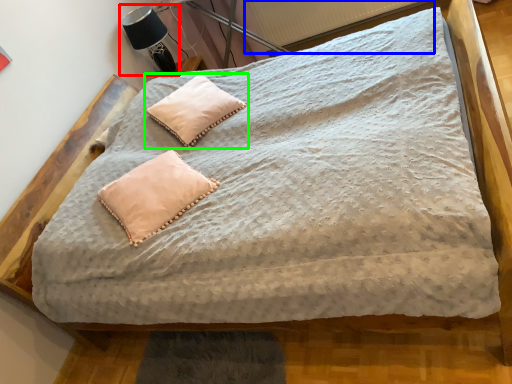
Question: Based on their relative distances, which object is farther from table lamp (highlighted by a red box)? Choose from radiator (highlighted by a blue box) and pillow (highlighted by a green box).

Choices:
 (A) radiator
 (B) pillow

Answer: (A)